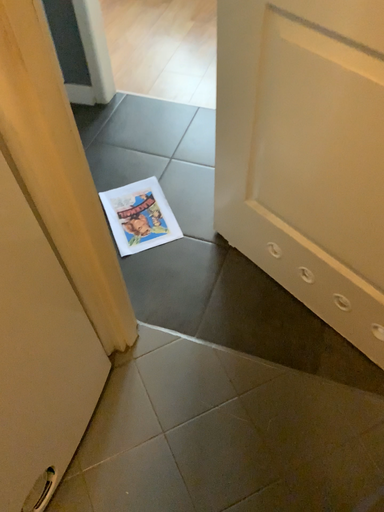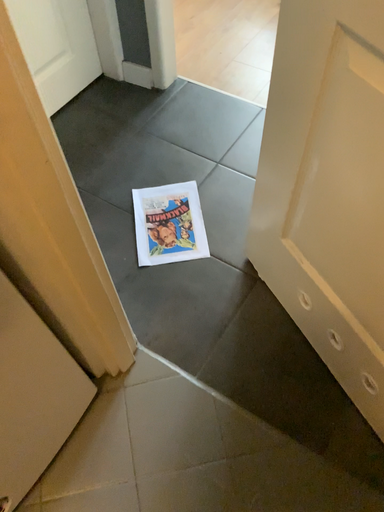
Question: How did the camera likely rotate when shooting the video?

Choices:
 (A) rotated left
 (B) rotated right

Answer: (A)